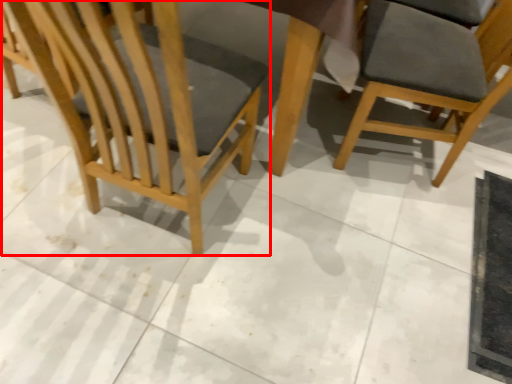
Question: From the image's perspective, where is chair (annotated by the red box) located in relation to chair in the image?

Choices:
 (A) below
 (B) above

Answer: (A)